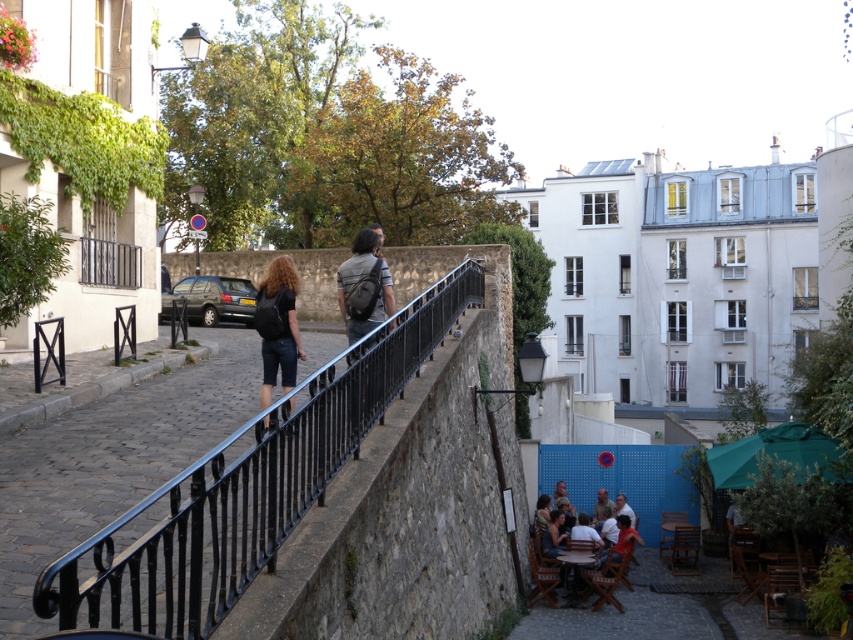
Between point (316, 477) and point (596, 508), which one is positioned in front?

Positioned in front is point (316, 477).

How much distance is there between black wrought iron railing at center and smooth skin face at lower center?

A distance of 19.81 meters exists between black wrought iron railing at center and smooth skin face at lower center.

This screenshot has height=640, width=853. What are the coordinates of `black wrought iron railing at center` in the screenshot? It's located at (245, 488).

Based on the photo, how distant is black matte backpack at center from matte gray backpack at center?

black matte backpack at center is 6.57 feet from matte gray backpack at center.

Does point (265, 278) lie behind point (343, 264)?

No, it is in front of (343, 264).

What do you see at coordinates (277, 324) in the screenshot? Image resolution: width=853 pixels, height=640 pixels. I see `black matte backpack at center` at bounding box center [277, 324].

What are the coordinates of `black matte backpack at center` in the screenshot? It's located at (277, 324).

Is black wrought iron railing at center to the left of black matte backpack at center from the viewer's perspective?

Incorrect, black wrought iron railing at center is not on the left side of black matte backpack at center.

Which of these two, black wrought iron railing at center or black matte backpack at center, stands taller?

With more height is black wrought iron railing at center.

Between point (59, 579) and point (288, 321), which one is positioned behind?

Positioned behind is point (288, 321).

Find the location of a particular element. Image resolution: width=853 pixels, height=640 pixels. black wrought iron railing at center is located at coordinates (245, 488).